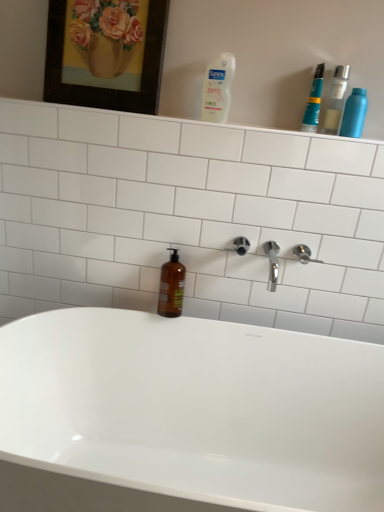
Identify the location of blank area to the left of teal plastic toothpaste at upper right, marked as the 1th mouthwash in a top-to-bottom arrangement. (274, 126).